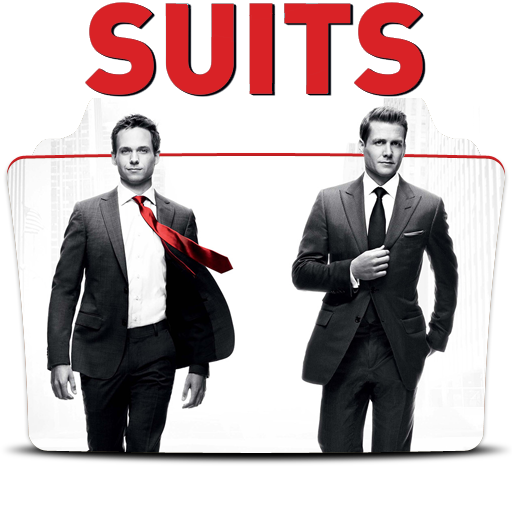
The width and height of the screenshot is (512, 512). Identify the location of empty space in the middle. (262, 187).